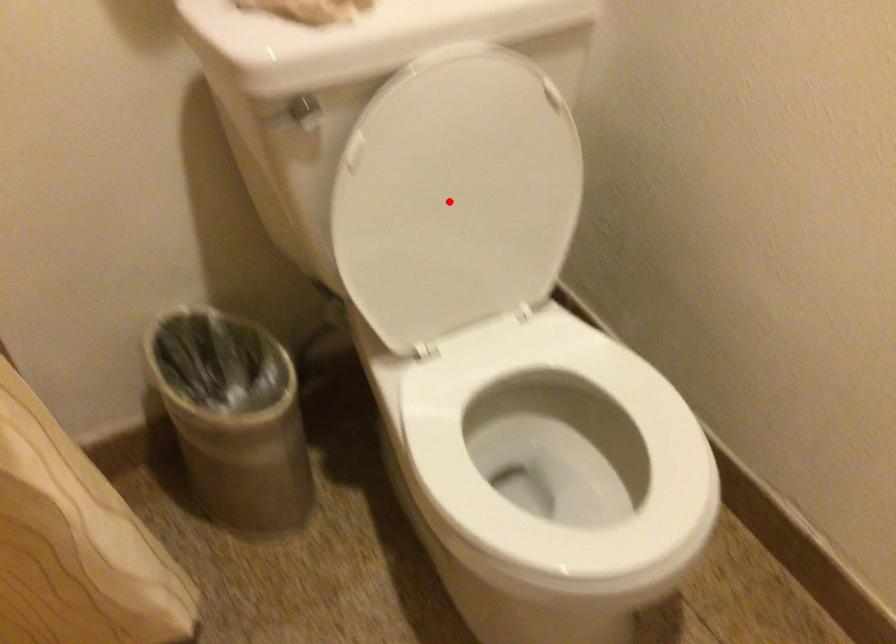
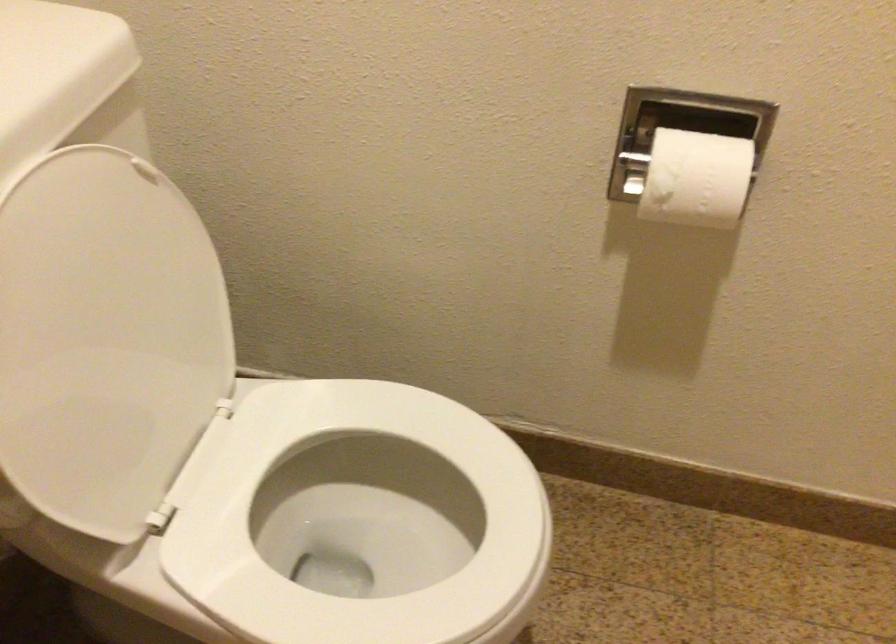
Question: I am providing you with two images of the same scene from different viewpoints. Image1 has a red point marked. In image2, the corresponding 3D location appears at what relative position? Reply with the corresponding letter.

Choices:
 (A) Closer
 (B) Farther

Answer: (A)